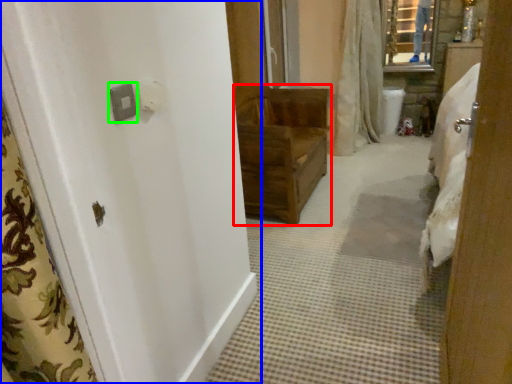
Question: Considering the real-world distances, which object is closest to furniture (highlighted by a red box)? door (highlighted by a blue box) or light switch (highlighted by a green box).

Choices:
 (A) door
 (B) light switch

Answer: (A)